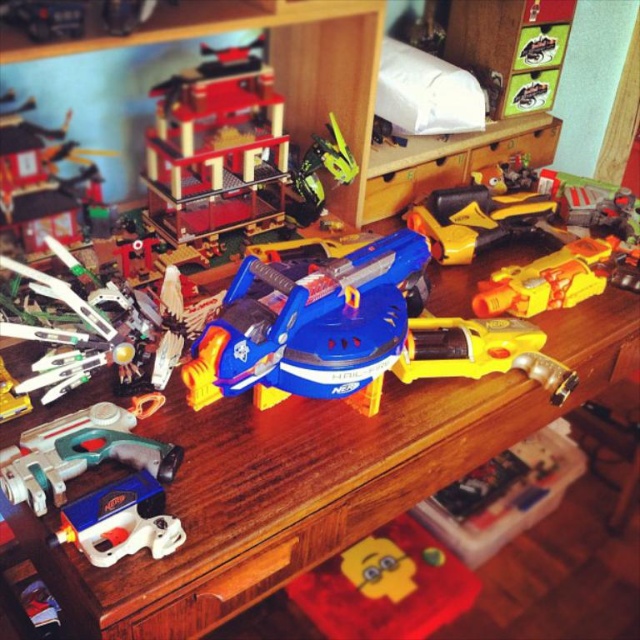
You are a toy organizer who needs to place a new toy that is 1.5 meters long on the desk. Considering the yellow plastic toy gun at center is currently occupying space, can you fit the new toy on the desk without moving any existing items?

The distance between the yellow plastic toy gun at center and the camera is 1.28 meters. Since the new toy is 1.5 meters long, which is longer than the available space in front of the gun, it might not fit without rearranging existing items.

You are a toy collector standing at a distance of 33.55 inches from the point marked at coordinates [192,372] on the desk. You want to place a new toy gun from Nerf that is 12 inches long on the desk without overlapping any existing toys. Can you fit the toy gun horizontally at that point?

The point marked at coordinates [192,372] is 33.55 inches away from you. Since the toy gun is 12 inches long, you can place it horizontally at that point as long as there is enough space along the horizontal axis. However, you must ensure that the area around the point isn not occupied by other toys to avoid overlapping.

You are looking at the desk and want to place a small sticker on the point that is closer to you. Which point should you choose between point (x=310, y=285) and point (x=490, y=234)?

Point (x=310, y=285) is closer to the viewer than point (x=490, y=234), so you should place the sticker there.